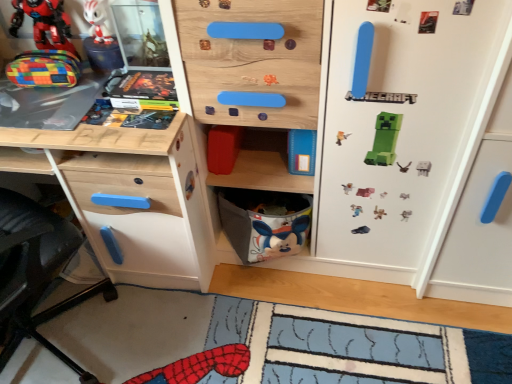
Question: Is the depth of white matte fridge at center greater than that of gray fabric basket at lower center?

Choices:
 (A) no
 (B) yes

Answer: (A)

Question: Is white matte fridge at center bigger than gray fabric basket at lower center?

Choices:
 (A) yes
 (B) no

Answer: (A)

Question: Is white matte fridge at center facing towards gray fabric basket at lower center?

Choices:
 (A) yes
 (B) no

Answer: (A)

Question: Can you confirm if white matte fridge at center is smaller than gray fabric basket at lower center?

Choices:
 (A) yes
 (B) no

Answer: (B)

Question: From a real-world perspective, is white matte fridge at center located higher than gray fabric basket at lower center?

Choices:
 (A) no
 (B) yes

Answer: (B)

Question: From the image's perspective, relative to gray fabric basket at lower center, is white matte fridge at center above or below?

Choices:
 (A) below
 (B) above

Answer: (B)

Question: Visually, is white matte fridge at center positioned to the left or to the right of gray fabric basket at lower center?

Choices:
 (A) right
 (B) left

Answer: (A)

Question: From a real-world perspective, is white matte fridge at center positioned above or below gray fabric basket at lower center?

Choices:
 (A) below
 (B) above

Answer: (B)

Question: In terms of height, does white matte fridge at center look taller or shorter compared to gray fabric basket at lower center?

Choices:
 (A) short
 (B) tall

Answer: (B)

Question: Choose the correct answer: Is white glossy figurine at upper left, marked as the third toy in a bottom-to-top arrangement, inside hardcover comic book at upper left or outside it?

Choices:
 (A) outside
 (B) inside

Answer: (A)

Question: In terms of width, does white glossy figurine at upper left, placed as the 1th toy when sorted from top to bottom, look wider or thinner when compared to hardcover comic book at upper left?

Choices:
 (A) wide
 (B) thin

Answer: (B)

Question: From the image's perspective, is white glossy figurine at upper left, marked as the third toy in a bottom-to-top arrangement, above or below hardcover comic book at upper left?

Choices:
 (A) below
 (B) above

Answer: (B)

Question: Is white glossy figurine at upper left, placed as the 1th toy when sorted from top to bottom, bigger or smaller than hardcover comic book at upper left?

Choices:
 (A) big
 (B) small

Answer: (B)

Question: Which is correct: wooden board game at upper left is inside matte plastic toy at upper left, positioned as the second toy in top-to-bottom order, or outside of it?

Choices:
 (A) outside
 (B) inside

Answer: (A)

Question: From a real-world perspective, is wooden board game at upper left physically located above or below matte plastic toy at upper left, positioned as the second toy in top-to-bottom order?

Choices:
 (A) below
 (B) above

Answer: (A)